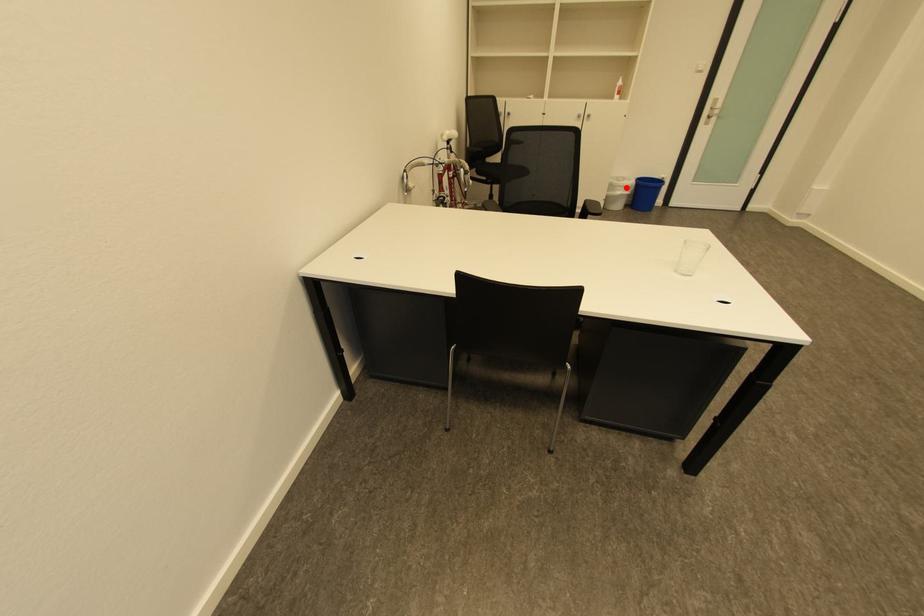
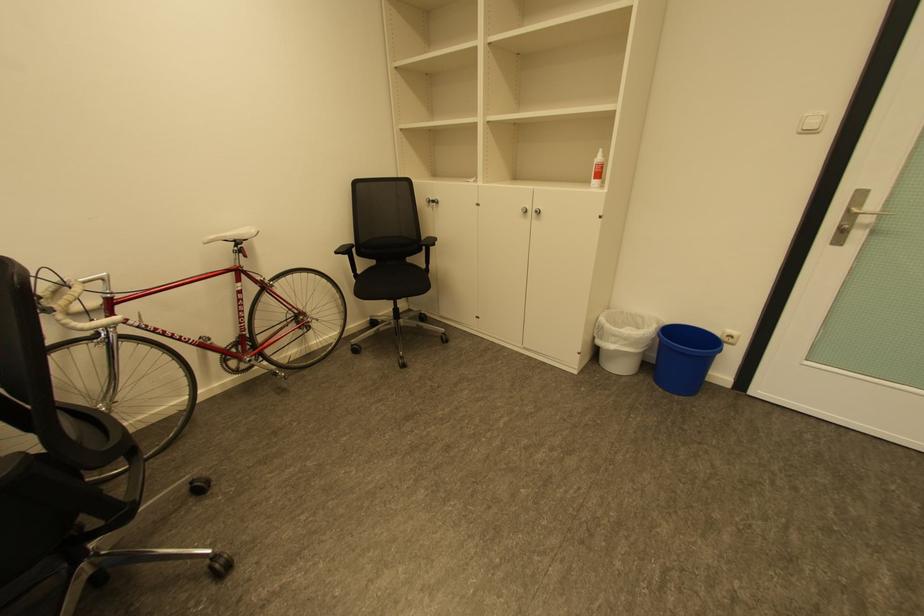
The point at the highlighted location is marked in the first image. Where is the corresponding point in the second image?

(622, 337)